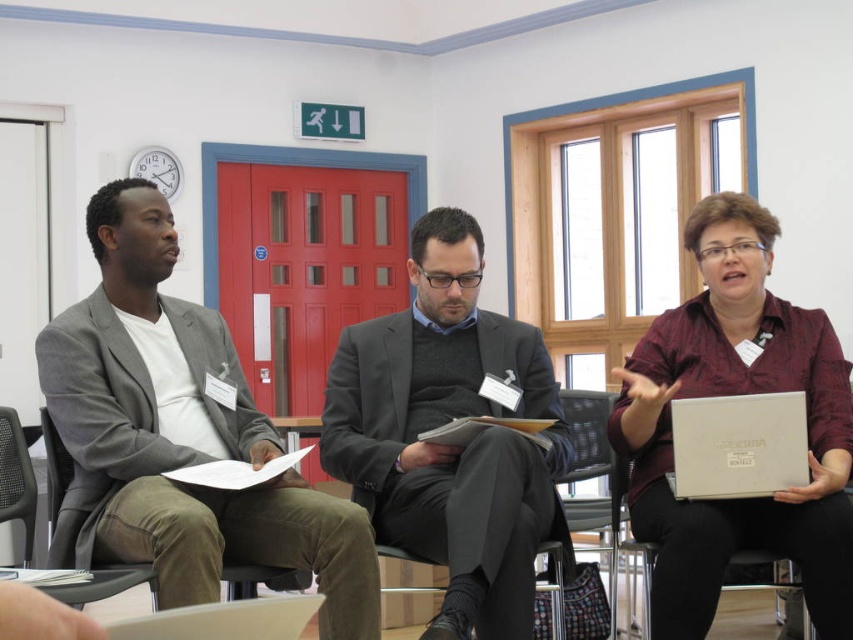
Is matte gray blazer at left below black mesh chair at left?

No, matte gray blazer at left is not below black mesh chair at left.

Can you confirm if matte gray blazer at left is bigger than black mesh chair at left?

Indeed, matte gray blazer at left has a larger size compared to black mesh chair at left.

At what (x,y) coordinates should I click in order to perform the action: click on matte gray blazer at left. Please return your answer as a coordinate pair (x, y). Looking at the image, I should click on (178, 436).

Image resolution: width=853 pixels, height=640 pixels. Find the location of `matte gray blazer at left`. matte gray blazer at left is located at coordinates (178, 436).

Between white matte laptop at center and black mesh chair at left, which one is positioned lower?

black mesh chair at left

Can you confirm if white matte laptop at center is wider than black mesh chair at left?

Yes, white matte laptop at center is wider than black mesh chair at left.

Where is `white matte laptop at center`? white matte laptop at center is located at coordinates (738, 445).

Which is more to the left, matte white laptop at center right or dark gray fabric chair at left?

dark gray fabric chair at left

Is matte white laptop at center right to the right of dark gray fabric chair at left from the viewer's perspective?

Indeed, matte white laptop at center right is positioned on the right side of dark gray fabric chair at left.

The height and width of the screenshot is (640, 853). What do you see at coordinates (735, 394) in the screenshot?
I see `matte white laptop at center right` at bounding box center [735, 394].

I want to click on matte white laptop at center right, so click(735, 394).